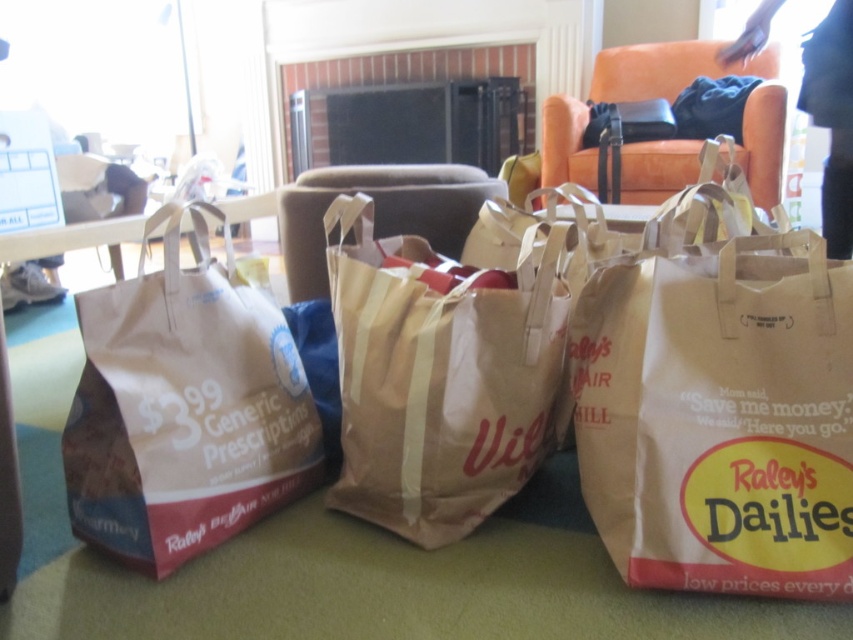
Question: In this image, where is brown paper bag at left located relative to brown paper bag at center?

Choices:
 (A) left
 (B) right

Answer: (A)

Question: Which of the following is the closest to the observer?

Choices:
 (A) (252, 506)
 (B) (392, 428)

Answer: (B)

Question: Does brown paper bag at left appear over brown paper bag at center?

Choices:
 (A) yes
 (B) no

Answer: (B)

Question: Which point is farther to the camera?

Choices:
 (A) (279, 340)
 (B) (457, 337)

Answer: (A)

Question: Which object is farther from the camera taking this photo?

Choices:
 (A) brown paper bag at center
 (B) brown paper bag at left

Answer: (A)

Question: Does brown paper bag at left appear under brown paper bag at center?

Choices:
 (A) no
 (B) yes

Answer: (B)